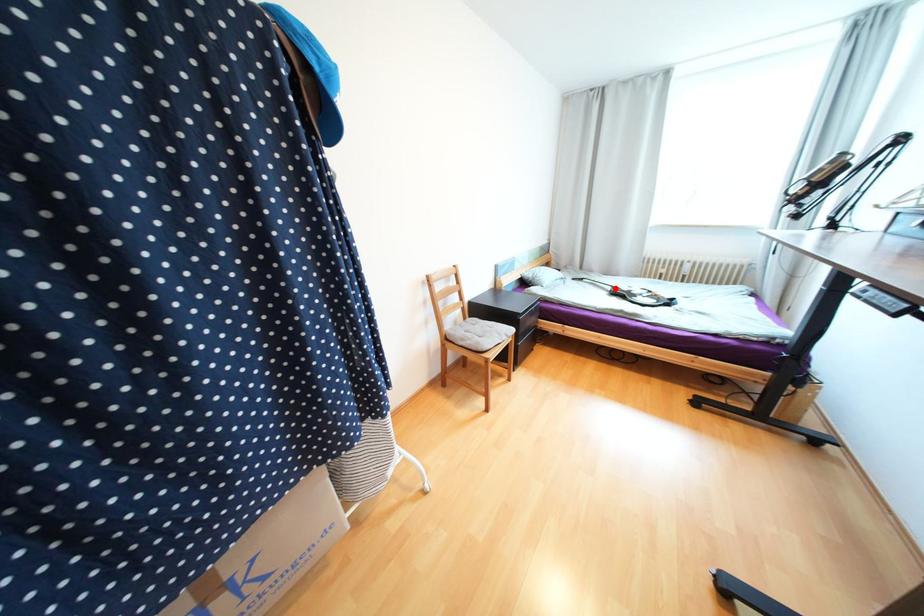
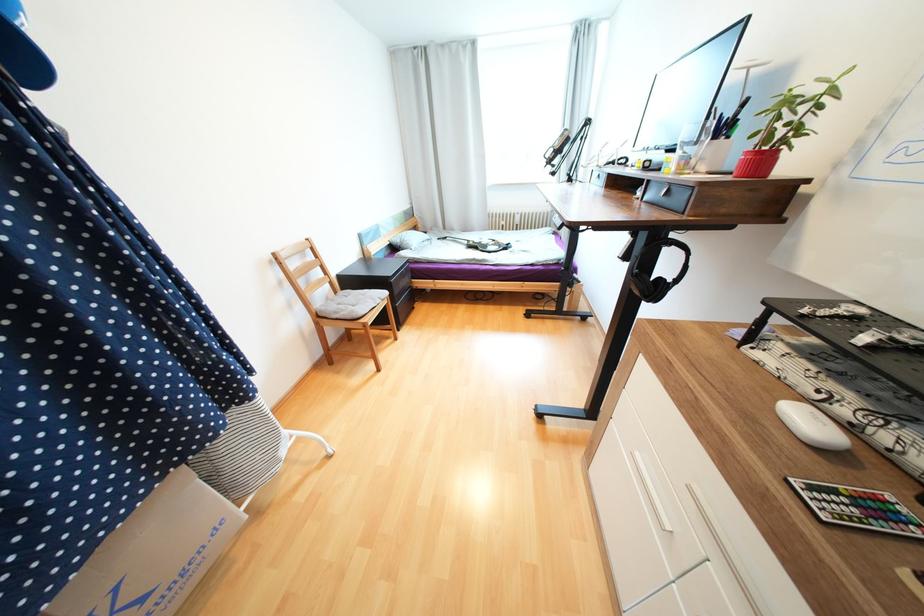
Question: A red point is marked in image1. In image2, is the corresponding 3D point closer to the camera or farther? Reply with the corresponding letter.

Choices:
 (A) The corresponding 3D point is closer.
 (B) The corresponding 3D point is farther.

Answer: (B)